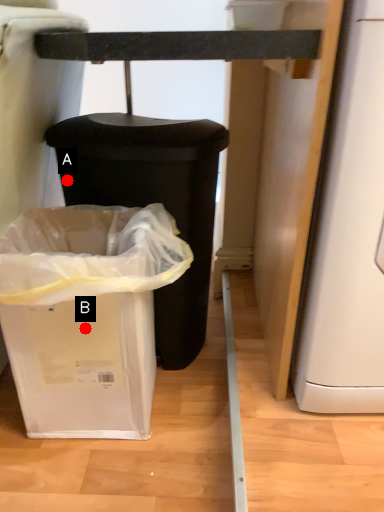
Question: Two points are circled on the image, labeled by A and B beside each circle. Which point is closer to the camera?

Choices:
 (A) A is closer
 (B) B is closer

Answer: (B)